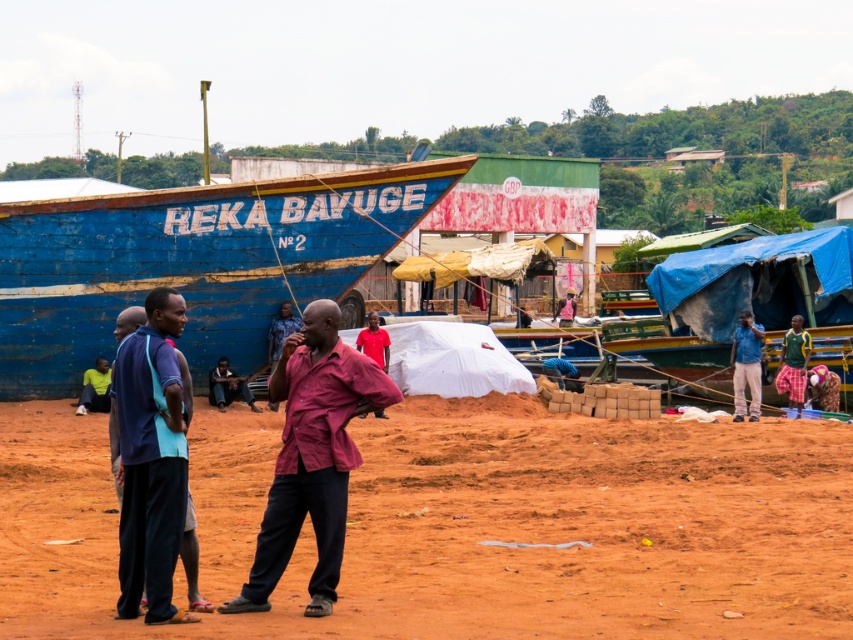
Based on the photo, does brown sandy dirt at center have a greater width compared to blue fabric pants at left?

Yes.

In the scene shown: Does brown sandy dirt at center appear on the right side of blue fabric pants at left?

Indeed, brown sandy dirt at center is positioned on the right side of blue fabric pants at left.

Who is more forward, (299, 592) or (173, 490)?

Positioned in front is point (173, 490).

This screenshot has width=853, height=640. I want to click on brown sandy dirt at center, so click(483, 529).

Is maroon fabric shirt at center bigger than blue fabric pants at left?

Actually, maroon fabric shirt at center might be smaller than blue fabric pants at left.

What do you see at coordinates (312, 456) in the screenshot? Image resolution: width=853 pixels, height=640 pixels. I see `maroon fabric shirt at center` at bounding box center [312, 456].

Find the location of a particular element. This screenshot has height=640, width=853. maroon fabric shirt at center is located at coordinates (312, 456).

Can you confirm if maroon fabric shirt at center is wider than blue denim jacket at upper right?

Incorrect, maroon fabric shirt at center's width does not surpass blue denim jacket at upper right's.

Between maroon fabric shirt at center and blue denim jacket at upper right, which one has more height?

blue denim jacket at upper right is taller.

In order to click on maroon fabric shirt at center in this screenshot , I will do `click(312, 456)`.

Where is `maroon fabric shirt at center`? This screenshot has height=640, width=853. maroon fabric shirt at center is located at coordinates (312, 456).